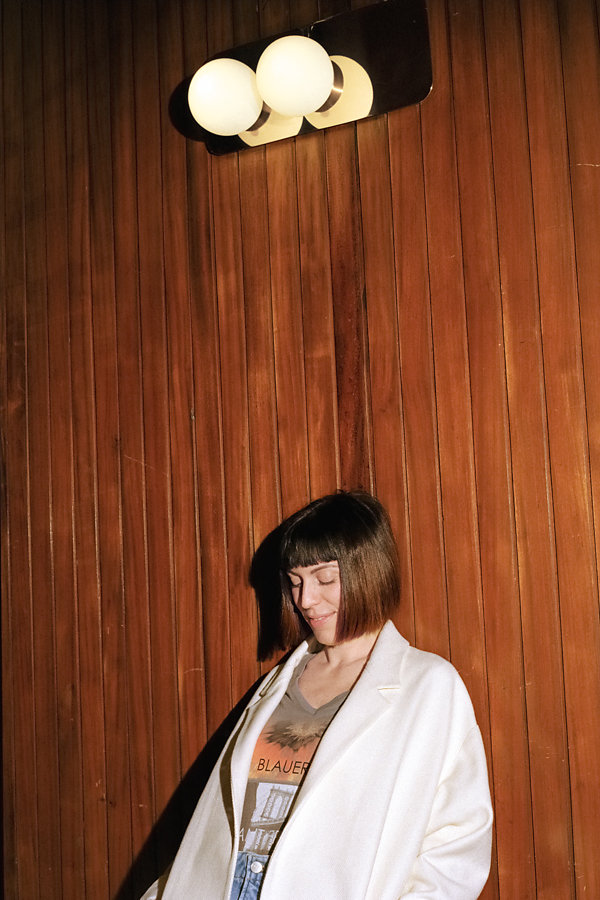
Locate an element on the screen. tiny wall scratches is located at coordinates (190, 669), (130, 455), (98, 781), (136, 802), (581, 159), (548, 748), (582, 877), (525, 687).